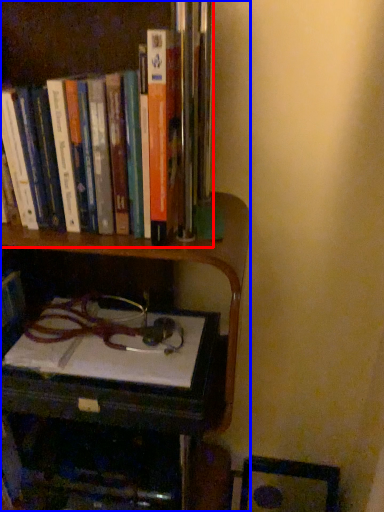
Question: Among these objects, which one is farthest to the camera, book (highlighted by a red box) or bookcase (highlighted by a blue box)?

Choices:
 (A) book
 (B) bookcase

Answer: (A)